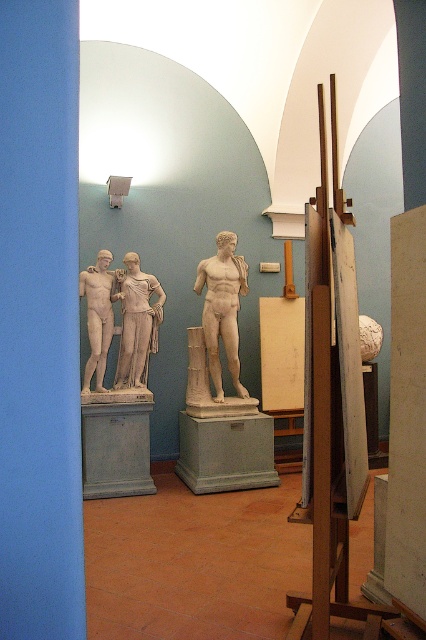
Question: Which of these objects is positioned farthest from the marble statue at center?

Choices:
 (A) white marble statue at center
 (B) matte white statue at center

Answer: (B)

Question: Is marble statue at center to the left of matte white statue at center from the viewer's perspective?

Choices:
 (A) yes
 (B) no

Answer: (B)

Question: Which object is farther from the camera taking this photo?

Choices:
 (A) marble statue at center
 (B) white marble statue at center

Answer: (A)

Question: Estimate the real-world distances between objects in this image. Which object is closer to the matte white statue at center?

Choices:
 (A) marble statue at center
 (B) white marble statue at center

Answer: (B)

Question: Can you confirm if marble statue at center is positioned above white marble statue at center?

Choices:
 (A) yes
 (B) no

Answer: (A)

Question: Does marble statue at center have a greater width compared to matte white statue at center?

Choices:
 (A) yes
 (B) no

Answer: (A)